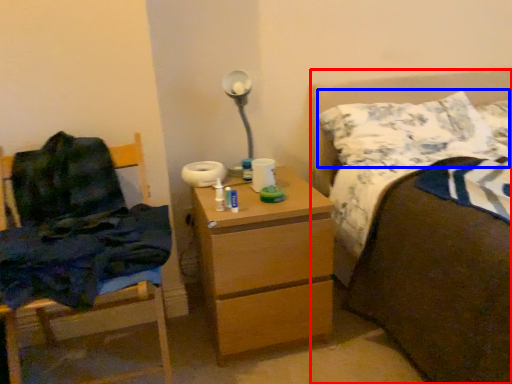
Question: Which of the following is the farthest to the observer, bed (highlighted by a red box) or pillow (highlighted by a blue box)?

Choices:
 (A) bed
 (B) pillow

Answer: (B)